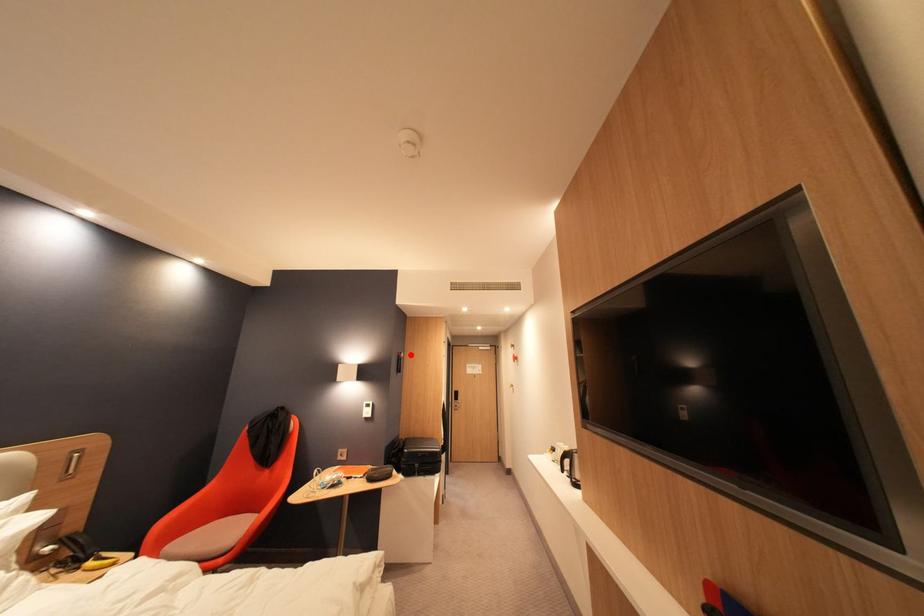
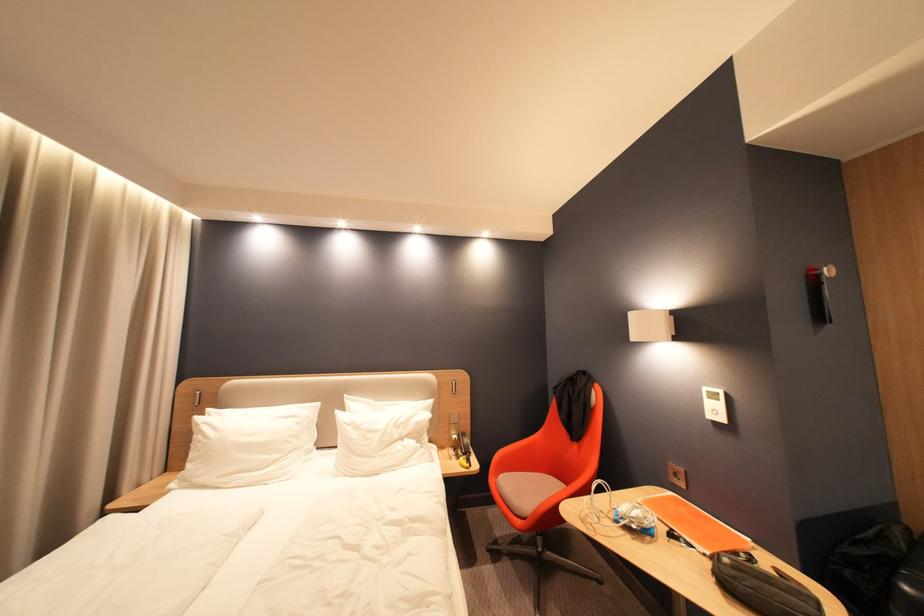
Locate, in the second image, the point that corresponds to the highlighted location in the first image.

(830, 270)